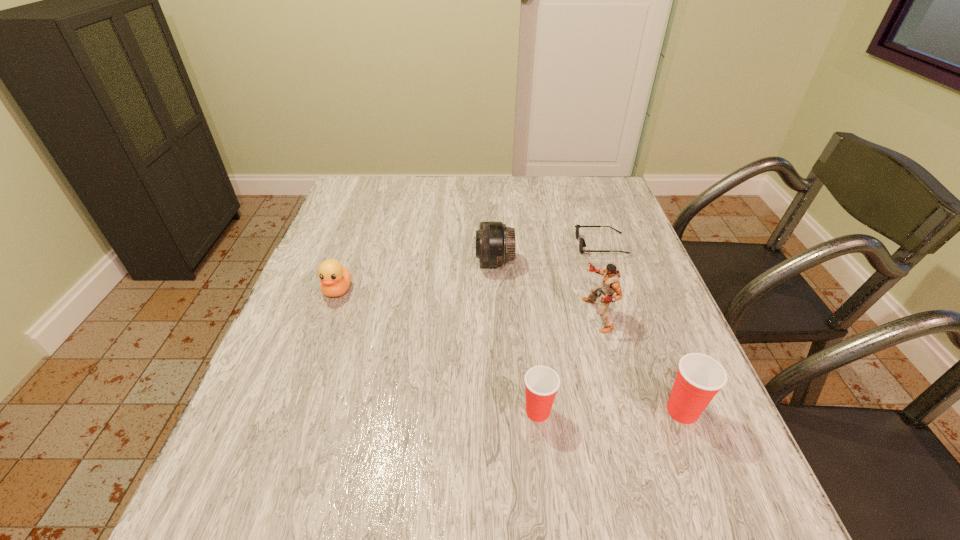
Please point a vacant point for placing a Dixie cup on the left. Please provide its 2D coordinates. Your answer should be formatted as a tuple, i.e. [(x, y)], where the tuple contains the x and y coordinates of a point satisfying the conditions above.

[(393, 412)]